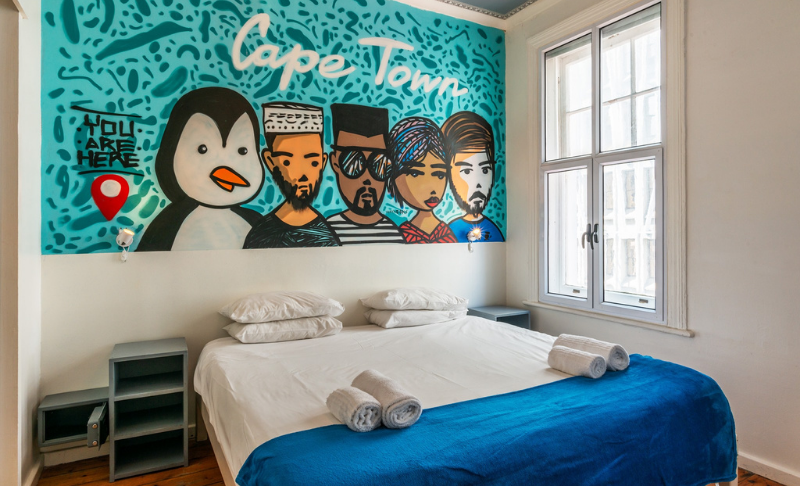
This screenshot has width=800, height=486. I want to click on bed, so click(x=450, y=396).